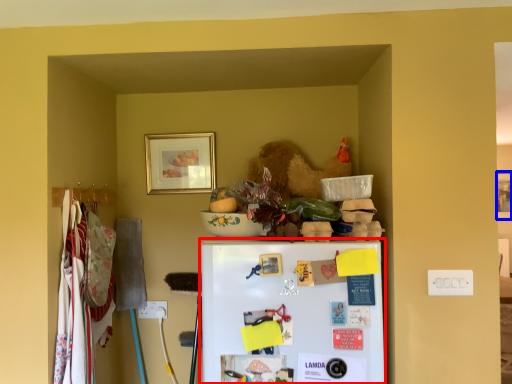
Question: Which object appears farthest to the camera in this image, refrigerator (highlighted by a red box) or picture frame (highlighted by a blue box)?

Choices:
 (A) refrigerator
 (B) picture frame

Answer: (B)